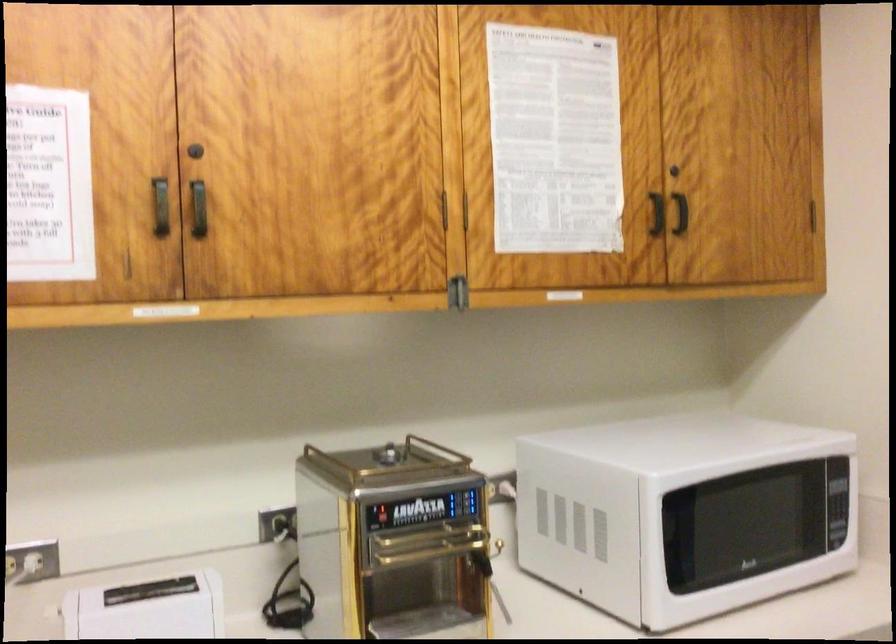
Find where to push the espresso machine lever. Please return your answer as a coordinate pair (x, y).

(487, 558)